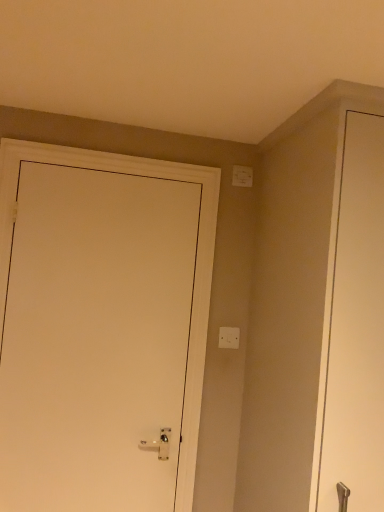
Measure the distance between white plastic light switch at center, positioned as the second light switch in top-to-bottom order, and camera.

white plastic light switch at center, positioned as the second light switch in top-to-bottom order, and camera are 1.71 meters apart from each other.

This screenshot has width=384, height=512. What are the coordinates of `white plastic light switch at upper right, arranged as the first light switch when viewed from the top` in the screenshot? It's located at (242, 176).

Does white plastic light switch at upper right, arranged as the first light switch when viewed from the top, touch white plastic light switch at center, positioned as the second light switch in top-to-bottom order?

They are not placed beside each other.

Based on their sizes in the image, would you say white plastic light switch at upper right, positioned as the second light switch in bottom-to-top order, is bigger or smaller than white plastic light switch at center, marked as the first light switch in a bottom-to-top arrangement?

Clearly, white plastic light switch at upper right, positioned as the second light switch in bottom-to-top order, is larger in size than white plastic light switch at center, marked as the first light switch in a bottom-to-top arrangement.

From the image's perspective, which one is positioned higher, white plastic light switch at upper right, arranged as the first light switch when viewed from the top, or white plastic light switch at center, positioned as the second light switch in top-to-bottom order?

white plastic light switch at upper right, arranged as the first light switch when viewed from the top, is shown above in the image.

Which is correct: white plastic light switch at upper right, arranged as the first light switch when viewed from the top, is inside white plastic light switch at center, positioned as the second light switch in top-to-bottom order, or outside of it?

white plastic light switch at upper right, arranged as the first light switch when viewed from the top, is not enclosed by white plastic light switch at center, positioned as the second light switch in top-to-bottom order.

From the image's perspective, relative to white plastic light switch at upper right, positioned as the second light switch in bottom-to-top order, is white matte door at left above or below?

From the image's perspective, white matte door at left appears below white plastic light switch at upper right, positioned as the second light switch in bottom-to-top order.

At what (x,y) coordinates should I click in order to perform the action: click on light switch above the white matte door at left (from the image's perspective). Please return your answer as a coordinate pair (x, y). The height and width of the screenshot is (512, 384). Looking at the image, I should click on (242, 176).

Is white matte door at left in front of or behind white plastic light switch at upper right, arranged as the first light switch when viewed from the top, in the image?

Clearly, white matte door at left is in front of white plastic light switch at upper right, arranged as the first light switch when viewed from the top.

Is white matte door at left aimed at white plastic light switch at upper right, arranged as the first light switch when viewed from the top?

No.

Looking at this image, which object is thinner, white plastic light switch at center, positioned as the second light switch in top-to-bottom order, or white matte door at left?

white plastic light switch at center, positioned as the second light switch in top-to-bottom order.

Looking at the image, does white plastic light switch at center, positioned as the second light switch in top-to-bottom order, seem bigger or smaller compared to white matte door at left?

Clearly, white plastic light switch at center, positioned as the second light switch in top-to-bottom order, is smaller in size than white matte door at left.

In the scene shown: Is white plastic light switch at center, positioned as the second light switch in top-to-bottom order, turned away from white matte door at left?

No, white plastic light switch at center, positioned as the second light switch in top-to-bottom order, is not facing the opposite direction of white matte door at left.

Is white plastic light switch at upper right, positioned as the second light switch in bottom-to-top order, shorter than white matte door at left?

Correct, white plastic light switch at upper right, positioned as the second light switch in bottom-to-top order, is not as tall as white matte door at left.

From the picture: Which is closer, (252, 182) or (28, 359)?

Point (252, 182) is positioned farther from the camera compared to point (28, 359).

This screenshot has width=384, height=512. Identify the location of door that is in front of the white plastic light switch at upper right, arranged as the first light switch when viewed from the top. (95, 339).

Is the surface of white plastic light switch at upper right, arranged as the first light switch when viewed from the top, in direct contact with white matte door at left?

white plastic light switch at upper right, arranged as the first light switch when viewed from the top, and white matte door at left are not in contact.

Which is more to the left, white matte door at left or white plastic light switch at center, positioned as the second light switch in top-to-bottom order?

white matte door at left.

Looking at this image, which is in front, white matte door at left or white plastic light switch at center, marked as the first light switch in a bottom-to-top arrangement?

white matte door at left.

From a real-world perspective, which object rests below the other?

From a 3D spatial view, white matte door at left is below.

From their relative heights in the image, would you say white matte door at left is taller or shorter than white plastic light switch at center, marked as the first light switch in a bottom-to-top arrangement?

Considering their sizes, white matte door at left has more height than white plastic light switch at center, marked as the first light switch in a bottom-to-top arrangement.

Which is in front, white plastic light switch at center, marked as the first light switch in a bottom-to-top arrangement, or white plastic light switch at upper right, arranged as the first light switch when viewed from the top?

Positioned in front is white plastic light switch at center, marked as the first light switch in a bottom-to-top arrangement.

Could you measure the distance between white plastic light switch at center, marked as the first light switch in a bottom-to-top arrangement, and white plastic light switch at upper right, arranged as the first light switch when viewed from the top?

white plastic light switch at center, marked as the first light switch in a bottom-to-top arrangement, is 24.23 inches from white plastic light switch at upper right, arranged as the first light switch when viewed from the top.

From the image's perspective, between white plastic light switch at center, marked as the first light switch in a bottom-to-top arrangement, and white plastic light switch at upper right, positioned as the second light switch in bottom-to-top order, which one is located above?

white plastic light switch at upper right, positioned as the second light switch in bottom-to-top order, is shown above in the image.

Between white plastic light switch at center, positioned as the second light switch in top-to-bottom order, and white plastic light switch at upper right, arranged as the first light switch when viewed from the top, which one has less height?

With less height is white plastic light switch at center, positioned as the second light switch in top-to-bottom order.

I want to click on light switch that appears on the left of white plastic light switch at upper right, positioned as the second light switch in bottom-to-top order, so click(x=229, y=337).

In the image, there is a white matte door at left. Find the location of `light switch above it (from the image's perspective)`. light switch above it (from the image's perspective) is located at coordinates (242, 176).

Looking at the image, which one is located closer to white plastic light switch at center, marked as the first light switch in a bottom-to-top arrangement, white matte door at left or white plastic light switch at upper right, arranged as the first light switch when viewed from the top?

Among the two, white matte door at left is located nearer to white plastic light switch at center, marked as the first light switch in a bottom-to-top arrangement.

Estimate the real-world distances between objects in this image. Which object is closer to white matte door at left, white plastic light switch at center, positioned as the second light switch in top-to-bottom order, or white plastic light switch at upper right, arranged as the first light switch when viewed from the top?

white plastic light switch at center, positioned as the second light switch in top-to-bottom order, lies closer to white matte door at left than the other object.

Which object lies further to the anchor point white plastic light switch at upper right, positioned as the second light switch in bottom-to-top order, white plastic light switch at center, positioned as the second light switch in top-to-bottom order, or white matte door at left?

The object further to white plastic light switch at upper right, positioned as the second light switch in bottom-to-top order, is white matte door at left.

Considering their positions, is white matte door at left positioned further to white plastic light switch at upper right, arranged as the first light switch when viewed from the top, than white plastic light switch at center, marked as the first light switch in a bottom-to-top arrangement?

Based on the image, white matte door at left appears to be further to white plastic light switch at upper right, arranged as the first light switch when viewed from the top.

From the image, which object appears to be nearer to white plastic light switch at center, positioned as the second light switch in top-to-bottom order, white plastic light switch at upper right, positioned as the second light switch in bottom-to-top order, or white matte door at left?

white matte door at left lies closer to white plastic light switch at center, positioned as the second light switch in top-to-bottom order, than the other object.

Which object lies further to the anchor point white matte door at left, white plastic light switch at upper right, positioned as the second light switch in bottom-to-top order, or white plastic light switch at center, positioned as the second light switch in top-to-bottom order?

white plastic light switch at upper right, positioned as the second light switch in bottom-to-top order, lies further to white matte door at left than the other object.

The width and height of the screenshot is (384, 512). Identify the location of door that lies between white plastic light switch at upper right, positioned as the second light switch in bottom-to-top order, and white plastic light switch at center, marked as the first light switch in a bottom-to-top arrangement, from top to bottom. click(x=95, y=339).